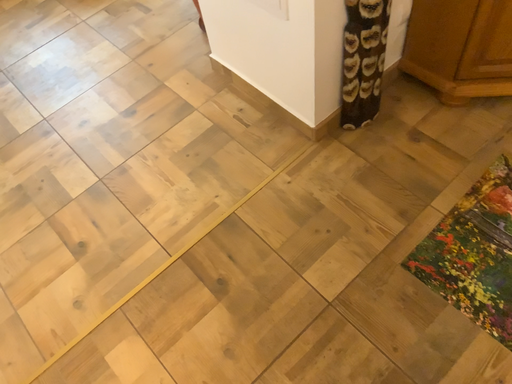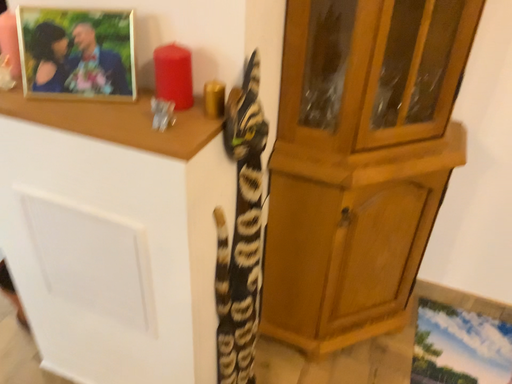
Question: How did the camera likely rotate when shooting the video?

Choices:
 (A) rotated right
 (B) rotated left

Answer: (A)